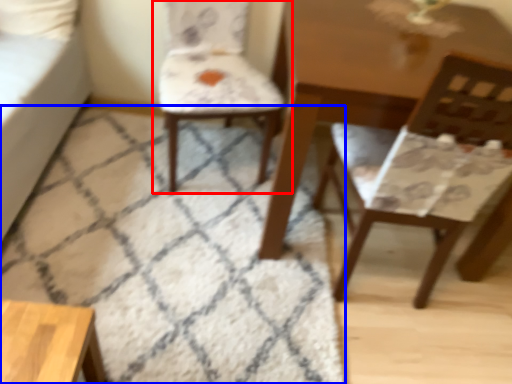
Question: Among these objects, which one is nearest to the camera, chair (highlighted by a red box) or mat (highlighted by a blue box)?

Choices:
 (A) chair
 (B) mat

Answer: (B)